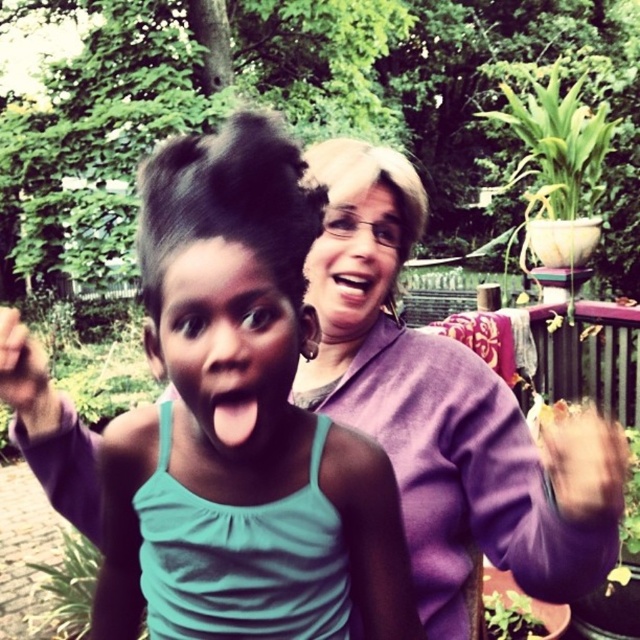
Question: Which object is farther from the camera taking this photo?

Choices:
 (A) purple sweater at upper right
 (B) matte black hand at upper left
 (C) smooth glossy mouth at center
 (D) translucent purple hand at right

Answer: (D)

Question: Estimate the real-world distances between objects in this image. Which object is closer to the green leafy plant at lower left?

Choices:
 (A) teal fabric shirt at center
 (B) green leafy plant at center
 (C) pink flesh at center
 (D) smooth glossy mouth at center

Answer: (B)

Question: Observing the image, what is the correct spatial positioning of green leafy plant at center in reference to smooth glossy mouth at center?

Choices:
 (A) below
 (B) above

Answer: (A)

Question: Based on their relative distances, which object is nearer to the purple sweater at upper right?

Choices:
 (A) green leafy plant at center
 (B) teal fabric shirt at center
 (C) pink flesh at center
 (D) green leafy plant at lower left

Answer: (B)

Question: Is matte black hand at upper left further to the viewer compared to pink flesh at center?

Choices:
 (A) no
 (B) yes

Answer: (B)

Question: Can you confirm if green leafy plant at lower left is positioned to the left of pink flesh at center?

Choices:
 (A) no
 (B) yes

Answer: (B)